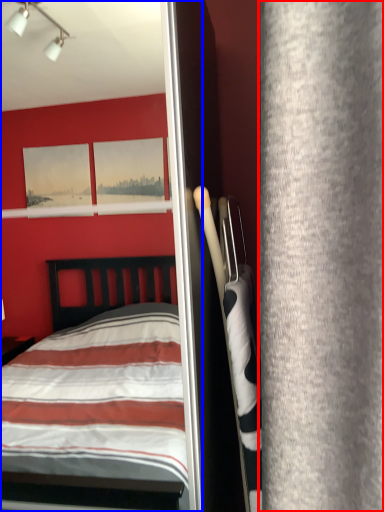
Question: Which object appears closest to the camera in this image, curtain (highlighted by a red box) or screen door (highlighted by a blue box)?

Choices:
 (A) curtain
 (B) screen door

Answer: (A)